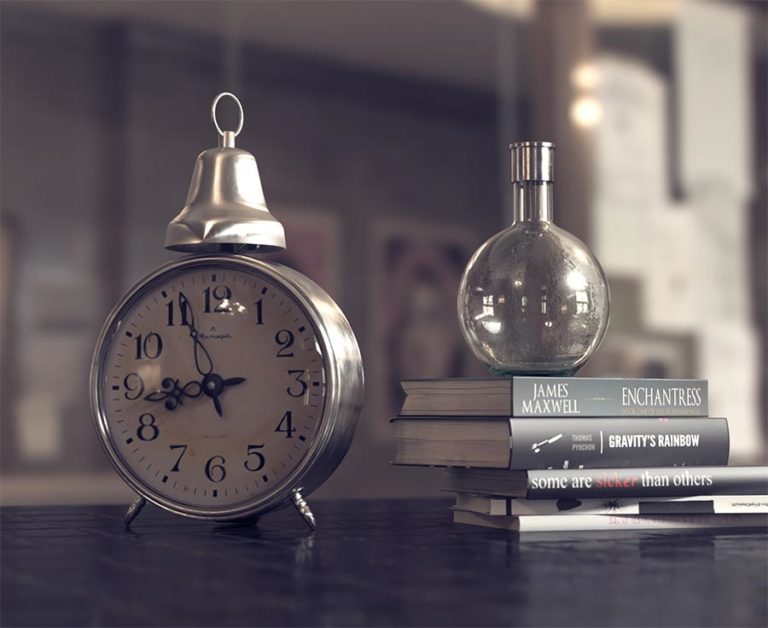
You are a GUI agent. You are given a task and a screenshot of the screen. Output one action in this format:
    pyautogui.click(x=<x>, y=<y>)
    Task: Click on the thin books stacked
    Image resolution: width=768 pixels, height=628 pixels.
    Given the screenshot: What is the action you would take?
    pyautogui.click(x=584, y=517), pyautogui.click(x=583, y=504)